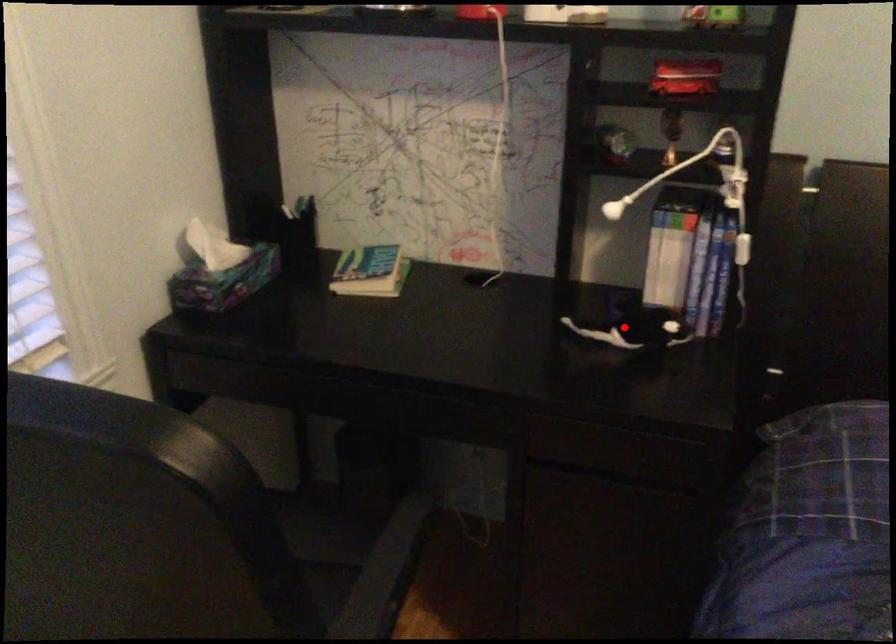
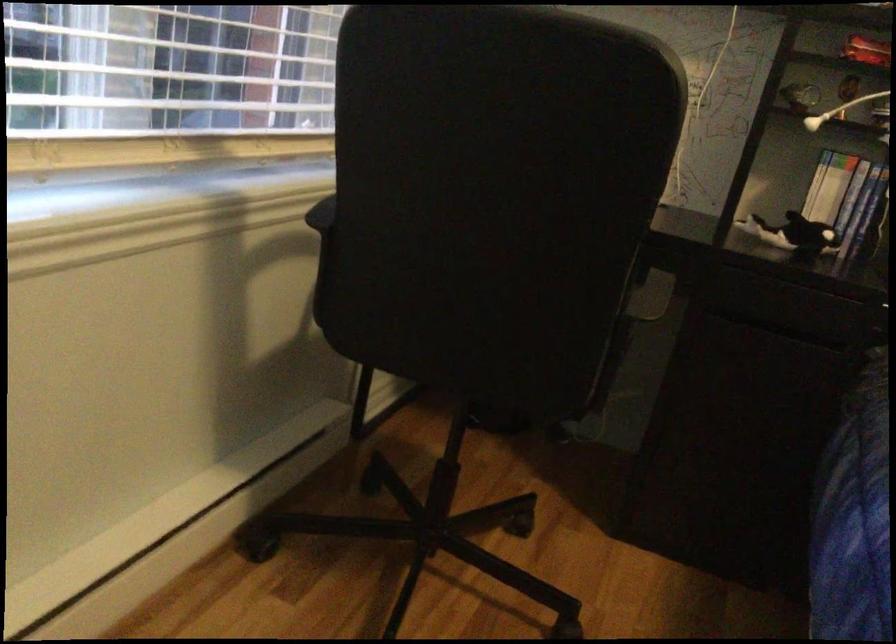
Where in the second image is the point corresponding to the highlighted location from the first image?

(793, 234)